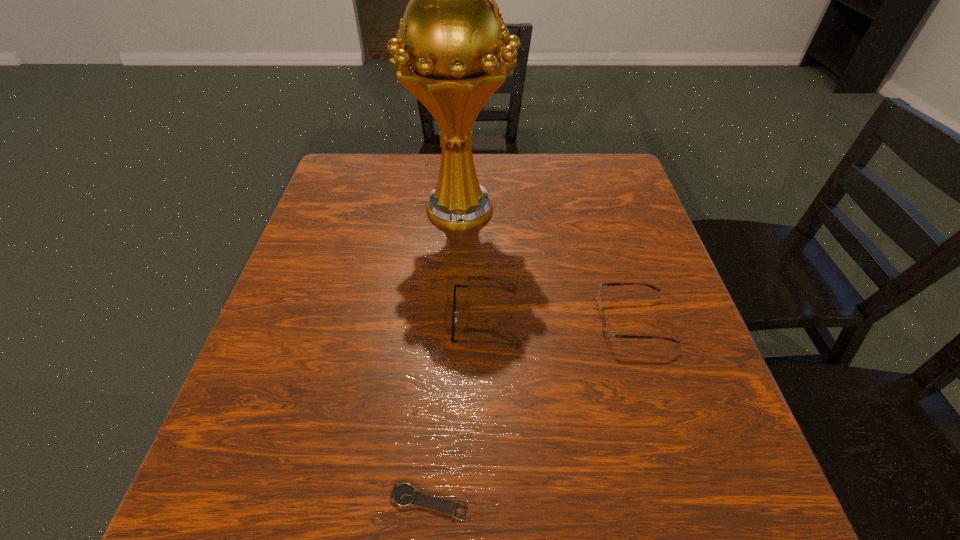
At what (x,y) coordinates should I click in order to perform the action: click on free space located 0.200m on the front-facing side of the right spectacles. Please return your answer as a coordinate pair (x, y). Looking at the image, I should click on (498, 321).

You are a GUI agent. You are given a task and a screenshot of the screen. Output one action in this format:
    pyautogui.click(x=<x>, y=<y>)
    Task: Click on the vacant space located 0.360m on the front-facing side of the right spectacles
    
    Given the screenshot: What is the action you would take?
    pyautogui.click(x=419, y=321)

The image size is (960, 540). Identify the location of free location located 0.190m on the front-facing side of the left spectacles. (359, 321).

Where is `free location located 0.190m on the front-facing side of the left spectacles`? Image resolution: width=960 pixels, height=540 pixels. free location located 0.190m on the front-facing side of the left spectacles is located at coordinates (359, 321).

This screenshot has width=960, height=540. In order to click on vacant space located on the front-facing side of the left spectacles in this screenshot , I will do `click(285, 321)`.

The image size is (960, 540). I want to click on free space located 0.120m on the left of the nearest object, so click(x=308, y=502).

Locate an element on the screen. The width and height of the screenshot is (960, 540). object at the far edge is located at coordinates (450, 52).

This screenshot has height=540, width=960. I want to click on object located at the near edge, so click(403, 494).

Identify the location of object located at the right edge. This screenshot has height=540, width=960. (607, 331).

Where is `free location at the far edge of the desktop`? free location at the far edge of the desktop is located at coordinates (551, 158).